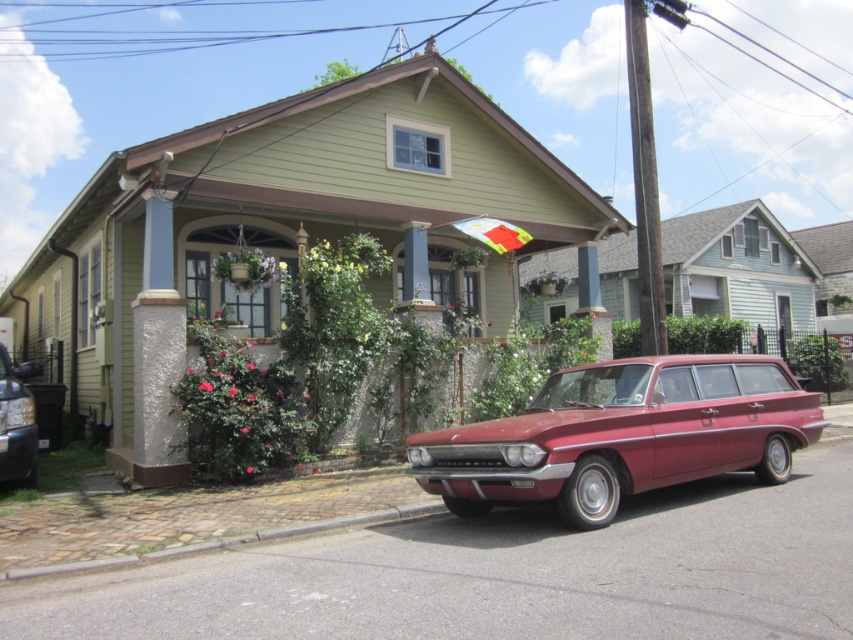
Question: Which point is closer to the camera?

Choices:
 (A) (18, 428)
 (B) (697, 467)

Answer: (B)

Question: Which object appears closest to the camera in this image?

Choices:
 (A) shiny black sedan at left
 (B) glossy red station wagon at center

Answer: (B)

Question: Does glossy red station wagon at center appear over shiny black sedan at left?

Choices:
 (A) yes
 (B) no

Answer: (A)

Question: Does glossy red station wagon at center have a lesser width compared to shiny black sedan at left?

Choices:
 (A) yes
 (B) no

Answer: (B)

Question: Can you confirm if glossy red station wagon at center is positioned to the right of shiny black sedan at left?

Choices:
 (A) yes
 (B) no

Answer: (A)